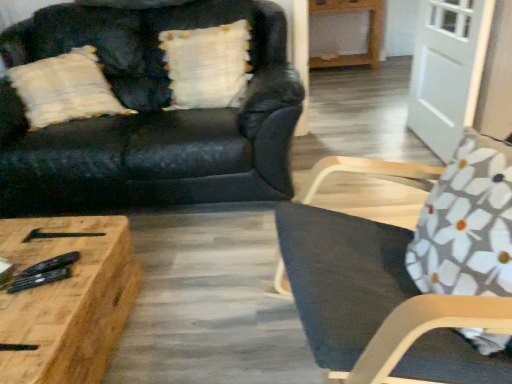
Measure the distance between light brown wooden table at upper right and camera.

They are 3.94 meters apart.

Describe the element at coordinates (467, 223) in the screenshot. I see `floral fabric cushion at right` at that location.

The width and height of the screenshot is (512, 384). What do you see at coordinates (411, 279) in the screenshot?
I see `dark gray fabric chair at right` at bounding box center [411, 279].

Measure the distance between point (x=446, y=208) and camera.

Point (x=446, y=208) and camera are 3.64 feet apart from each other.

Image resolution: width=512 pixels, height=384 pixels. What do you see at coordinates (447, 70) in the screenshot?
I see `white glossy door at upper right` at bounding box center [447, 70].

At what (x,y) coordinates should I click in order to perform the action: click on matte black couch at upper left. Please return your answer as a coordinate pair (x, y). The image size is (512, 384). Looking at the image, I should click on (150, 117).

Does white glossy door at upper right lie in front of matte black couch at upper left?

No, white glossy door at upper right is behind matte black couch at upper left.

The width and height of the screenshot is (512, 384). What are the coordinates of `glass door lying above the matte black couch at upper left (from the image's perspective)` in the screenshot? It's located at (447, 70).

Does white glossy door at upper right have a greater height compared to matte black couch at upper left?

In fact, white glossy door at upper right may be shorter than matte black couch at upper left.

Is white glossy door at upper right facing away from matte black couch at upper left?

white glossy door at upper right is not turned away from matte black couch at upper left.

Where is `throw pillow below the white glossy door at upper right (from the image's perspective)`? Image resolution: width=512 pixels, height=384 pixels. throw pillow below the white glossy door at upper right (from the image's perspective) is located at coordinates (467, 223).

In the scene shown: Can you tell me how much white glossy door at upper right and floral fabric cushion at right differ in facing direction?

The facing directions of white glossy door at upper right and floral fabric cushion at right are 9.36 degrees apart.

Between white glossy door at upper right and floral fabric cushion at right, which one has more height?

Standing taller between the two is white glossy door at upper right.

Is there a large distance between white glossy door at upper right and floral fabric cushion at right?

Yes.

Considering the positions of objects dark gray fabric chair at right and light brown wooden table at upper right in the image provided, who is in front, dark gray fabric chair at right or light brown wooden table at upper right?

Positioned in front is dark gray fabric chair at right.

Is dark gray fabric chair at right positioned with its back to light brown wooden table at upper right?

dark gray fabric chair at right does not have its back to light brown wooden table at upper right.

Does dark gray fabric chair at right have a lesser height compared to light brown wooden table at upper right?

No.

Where is `hardwood on the right of the dark gray fabric chair at right`? This screenshot has width=512, height=384. hardwood on the right of the dark gray fabric chair at right is located at coordinates (367, 33).

Looking at the image, does white textured pillow at upper center seem bigger or smaller compared to light brown wooden table at upper right?

Clearly, white textured pillow at upper center is smaller in size than light brown wooden table at upper right.

Is white textured pillow at upper center not close to light brown wooden table at upper right?

Absolutely, white textured pillow at upper center is distant from light brown wooden table at upper right.

Based on the photo, do you think white textured pillow at upper center is within light brown wooden table at upper right, or outside of it?

The correct answer is: outside.

Is white textured pillow at upper center in front of or behind light brown wooden table at upper right in the image?

white textured pillow at upper center is in front of light brown wooden table at upper right.

How much distance is there between white textured pillow at upper center and floral fabric cushion at right?

The distance of white textured pillow at upper center from floral fabric cushion at right is 4.74 feet.

From the image's perspective, is white textured pillow at upper center over floral fabric cushion at right?

Yes, from the image's perspective, white textured pillow at upper center is over floral fabric cushion at right.

Considering the relative sizes of white textured pillow at upper center and floral fabric cushion at right in the image provided, is white textured pillow at upper center wider than floral fabric cushion at right?

No.

Is dark gray fabric chair at right outside of wooden coffee table at lower left?

dark gray fabric chair at right lies outside wooden coffee table at lower left's area.

From the image's perspective, is dark gray fabric chair at right over wooden coffee table at lower left?

Yes, from the image's perspective, dark gray fabric chair at right is above wooden coffee table at lower left.

Measure the distance between dark gray fabric chair at right and wooden coffee table at lower left.

A distance of 30.76 inches exists between dark gray fabric chair at right and wooden coffee table at lower left.

Consider the image. Considering the relative positions of dark gray fabric chair at right and wooden coffee table at lower left in the image provided, is dark gray fabric chair at right in front of wooden coffee table at lower left?

Yes, the depth of dark gray fabric chair at right is less than that of wooden coffee table at lower left.

How different are the orientations of white textured pillow at upper center and white glossy door at upper right in degrees?

The angle between the facing direction of white textured pillow at upper center and the facing direction of white glossy door at upper right is 78.9 degrees.

Is point (184, 53) positioned after point (425, 16)?

No, it is not.

From the picture: Who is taller, white textured pillow at upper center or white glossy door at upper right?

white glossy door at upper right is taller.

Is white textured pillow at upper center behind white glossy door at upper right?

Yes, the depth of white textured pillow at upper center is greater than that of white glossy door at upper right.

Locate an element on the screen. This screenshot has width=512, height=384. glass door beneath the matte black couch at upper left (from a real-world perspective) is located at coordinates (447, 70).

Identify the location of throw pillow below the white glossy door at upper right (from the image's perspective). (467, 223).

Looking at the image, which one is located further to light brown wooden table at upper right, white textured pillow at upper center or floral fabric cushion at right?

floral fabric cushion at right lies further to light brown wooden table at upper right than the other object.

Considering their positions, is dark gray fabric chair at right positioned further to white glossy door at upper right than light brown wooden table at upper right?

light brown wooden table at upper right.

Estimate the real-world distances between objects in this image. Which object is closer to dark gray fabric chair at right, floral fabric cushion at right or wooden coffee table at lower left?

floral fabric cushion at right is positioned closer to the anchor dark gray fabric chair at right.

Considering their positions, is dark gray fabric chair at right positioned further to light brown wooden table at upper right than matte black couch at upper left?

dark gray fabric chair at right.

Which object lies nearer to the anchor point white glossy door at upper right, floral fabric cushion at right or dark gray fabric chair at right?

Based on the image, floral fabric cushion at right appears to be nearer to white glossy door at upper right.

Estimate the real-world distances between objects in this image. Which object is closer to light brown wooden table at upper right, dark gray fabric chair at right or white textured pillow at upper center?

white textured pillow at upper center lies closer to light brown wooden table at upper right than the other object.

Looking at the image, which one is located closer to dark gray fabric chair at right, wooden coffee table at lower left or white glossy door at upper right?

wooden coffee table at lower left is positioned closer to the anchor dark gray fabric chair at right.

When comparing their distances from light brown wooden table at upper right, does white textured pillow at upper center or dark gray fabric chair at right seem further?

dark gray fabric chair at right is further to light brown wooden table at upper right.

Image resolution: width=512 pixels, height=384 pixels. In order to click on studio couch between wooden coffee table at lower left and floral fabric cushion at right from left to right in this screenshot , I will do `click(150, 117)`.

This screenshot has height=384, width=512. What are the coordinates of `pillow between matte black couch at upper left and light brown wooden table at upper right from front to back` in the screenshot? It's located at coord(207,65).

At what (x,y) coordinates should I click in order to perform the action: click on studio couch between floral fabric cushion at right and light brown wooden table at upper right along the z-axis. Please return your answer as a coordinate pair (x, y). This screenshot has height=384, width=512. Looking at the image, I should click on (150, 117).

Where is `chair located between wooden coffee table at lower left and floral fabric cushion at right in the left-right direction`? The height and width of the screenshot is (384, 512). chair located between wooden coffee table at lower left and floral fabric cushion at right in the left-right direction is located at coordinates (411, 279).